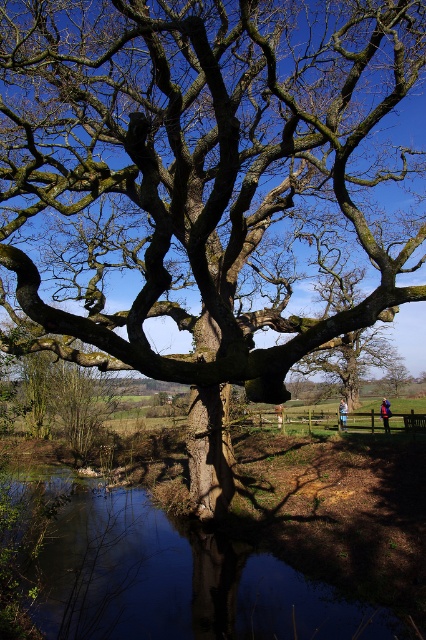
You are standing at the edge of the water in the rural landscape scene. You see a blue fabric jacket at center located at point (385, 413). If you walk straight towards the jacket, will you have to cross the water?

The blue fabric jacket at center is located at point (385, 413). Since the jacket is at the center and the water is at the lower part of the scene, walking straight towards it would not require crossing the water.

You are standing in the serene rural landscape and see the smooth reflective water at lower center and the blue fabric jacket at lower right. Which object is closer to you?

The smooth reflective water at lower center is positioned over the blue fabric jacket at lower right, so the smooth reflective water at lower center is closer to you.